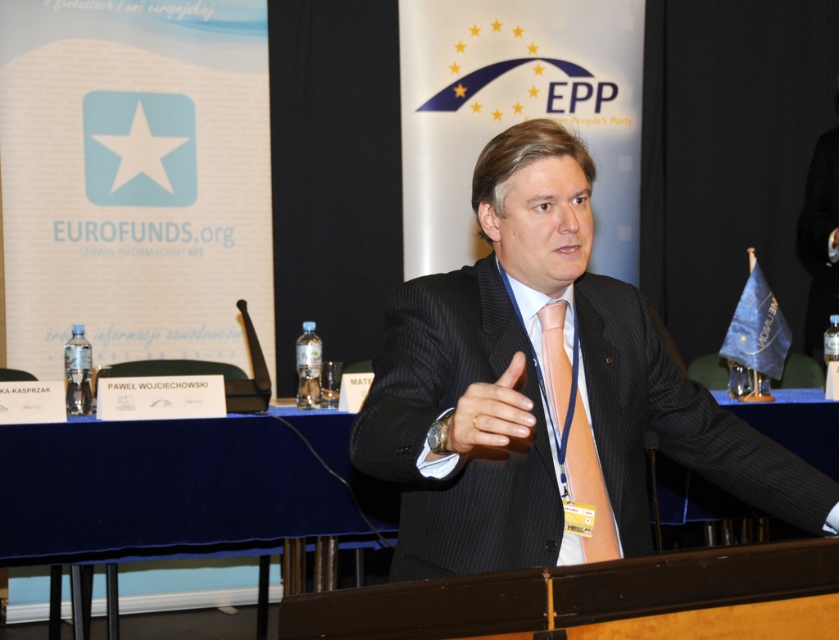
Who is positioned more to the right, dark gray suit at center or pinstriped suit at center?

Positioned to the right is dark gray suit at center.

Which is below, dark gray suit at center or pinstriped suit at center?

dark gray suit at center is below.

Describe the element at coordinates (545, 392) in the screenshot. Image resolution: width=839 pixels, height=640 pixels. I see `dark gray suit at center` at that location.

You are a GUI agent. You are given a task and a screenshot of the screen. Output one action in this format:
    pyautogui.click(x=<x>, y=<y>)
    Task: Click on the dark gray suit at center
    This screenshot has width=839, height=640.
    Given the screenshot: What is the action you would take?
    pyautogui.click(x=545, y=392)

Is point (324, 468) farther from viewer compared to point (493, 451)?

Yes, point (324, 468) is behind point (493, 451).

Between blue fabric table at center and pinstriped suit at center, which one has less height?

Standing shorter between the two is pinstriped suit at center.

Find the location of `blue fabric table at center`. blue fabric table at center is located at coordinates (162, 490).

The image size is (839, 640). Find the location of `blue fabric table at center`. blue fabric table at center is located at coordinates (162, 490).

Is dark gray suit at center bigger than orange satin tie at center?

Indeed, dark gray suit at center has a larger size compared to orange satin tie at center.

The height and width of the screenshot is (640, 839). Describe the element at coordinates (545, 392) in the screenshot. I see `dark gray suit at center` at that location.

Where is `dark gray suit at center`? Image resolution: width=839 pixels, height=640 pixels. dark gray suit at center is located at coordinates (545, 392).